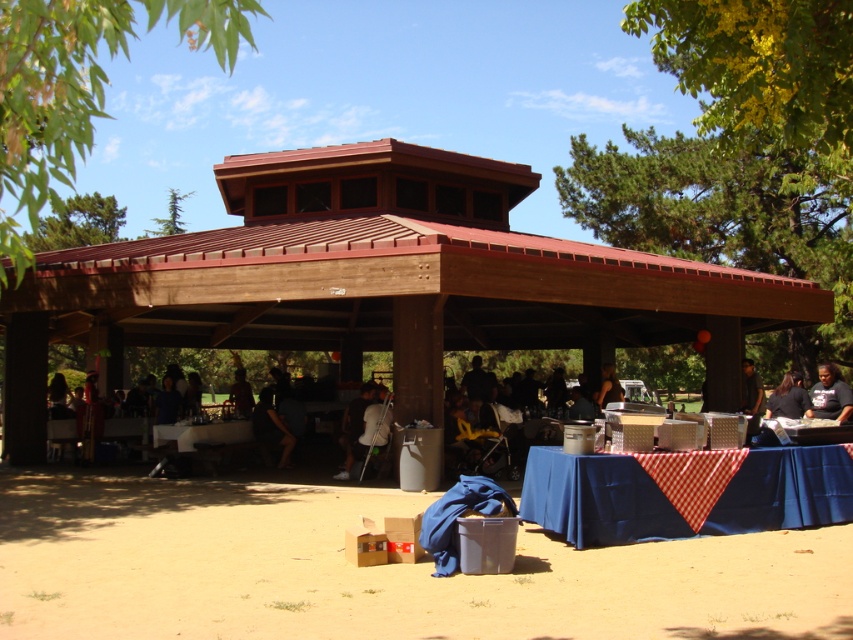
Does black fabric at center appear on the right side of green coniferous tree at upper left?

Indeed, black fabric at center is positioned on the right side of green coniferous tree at upper left.

Can you confirm if black fabric at center is shorter than green coniferous tree at upper left?

Indeed, black fabric at center has a lesser height compared to green coniferous tree at upper left.

Describe the element at coordinates (788, 397) in the screenshot. I see `black fabric at center` at that location.

The image size is (853, 640). What are the coordinates of `black fabric at center` in the screenshot? It's located at (788, 397).

In the scene shown: Is black cotton shirt at center bigger than dark blue shirt at center?

No.

Does black cotton shirt at center appear under dark blue shirt at center?

Incorrect, black cotton shirt at center is not positioned below dark blue shirt at center.

Is point (848, 410) in front of point (254, 417)?

Yes, point (848, 410) is in front of point (254, 417).

The width and height of the screenshot is (853, 640). In order to click on black cotton shirt at center in this screenshot , I will do `click(830, 394)`.

Looking at this image, which is more to the right, brown wooden hut at center or dark gray fabric chair at center?

Positioned to the right is brown wooden hut at center.

Does brown wooden hut at center have a smaller size compared to dark gray fabric chair at center?

No.

Between point (703, 269) and point (363, 394), which one is positioned in front?

Point (363, 394)

Locate an element on the screen. brown wooden hut at center is located at coordinates (376, 282).